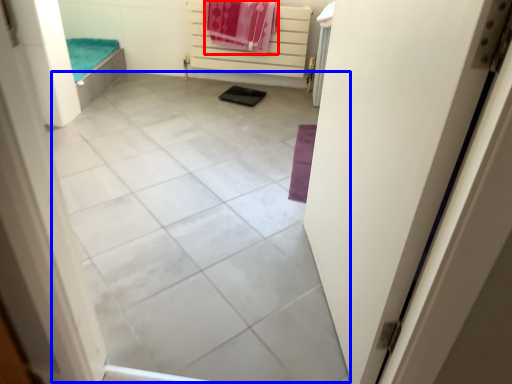
Question: Which object is closer to the camera taking this photo, beach towel (highlighted by a red box) or tile (highlighted by a blue box)?

Choices:
 (A) beach towel
 (B) tile

Answer: (B)